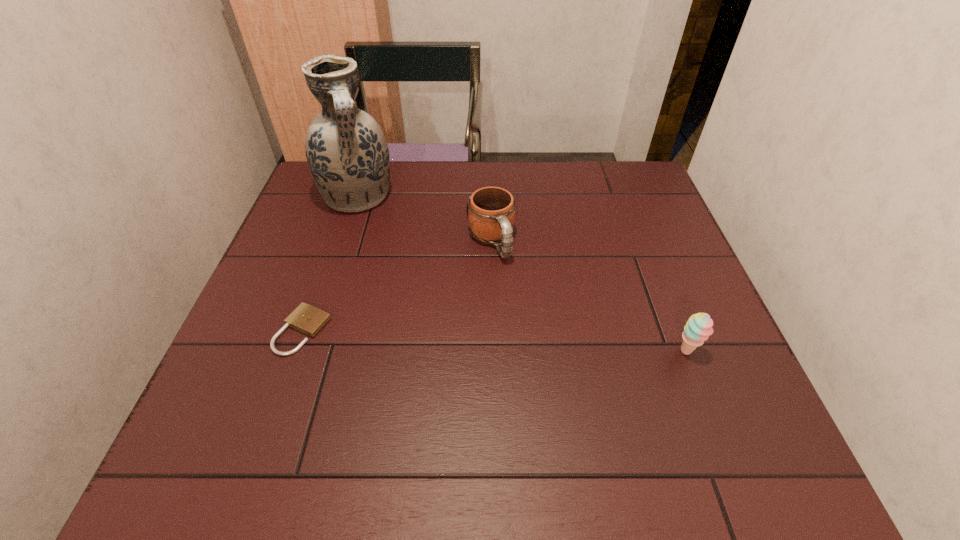
Locate an element on the screen. This screenshot has height=540, width=960. free space located 0.080m on the side of the second object from right to left with the handle is located at coordinates (510, 287).

What are the coordinates of `vacant space located on the side of the second object from right to left with the handle` in the screenshot? It's located at (557, 382).

In order to click on object that is at the far edge in this screenshot , I will do `click(346, 150)`.

I want to click on padlock located in the left edge section of the desktop, so click(x=307, y=319).

The height and width of the screenshot is (540, 960). What are the coordinates of `vase present at the left edge` in the screenshot? It's located at (346, 150).

At what (x,y) coordinates should I click in order to perform the action: click on object situated at the right edge. Please return your answer as a coordinate pair (x, y). Looking at the image, I should click on (698, 328).

Where is `object present at the far left corner`? object present at the far left corner is located at coordinates (346, 150).

Find the location of a particular element. blank area at the far edge is located at coordinates (429, 178).

At what (x,y) coordinates should I click in order to perform the action: click on vacant area at the left edge. Please return your answer as a coordinate pair (x, y). Image resolution: width=960 pixels, height=540 pixels. Looking at the image, I should click on (261, 375).

Where is `free region at the right edge of the desktop`? free region at the right edge of the desktop is located at coordinates (631, 236).